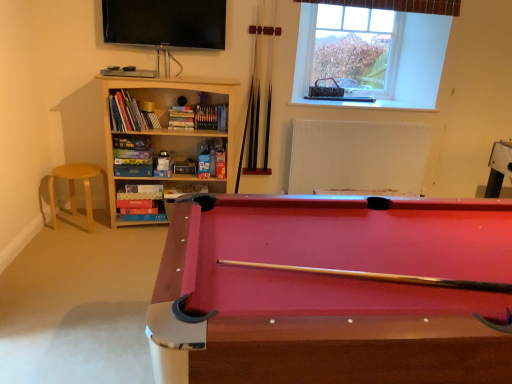
Question: Can you confirm if clear glass window at upper center is shorter than wooden bookcase at left?

Choices:
 (A) yes
 (B) no

Answer: (A)

Question: Is clear glass window at upper center not close to wooden bookcase at left?

Choices:
 (A) yes
 (B) no

Answer: (A)

Question: Considering the relative positions of clear glass window at upper center and wooden bookcase at left in the image provided, is clear glass window at upper center in front of wooden bookcase at left?

Choices:
 (A) no
 (B) yes

Answer: (A)

Question: Could you tell me if clear glass window at upper center is turned towards wooden bookcase at left?

Choices:
 (A) no
 (B) yes

Answer: (A)

Question: Is wooden bookcase at left at the back of clear glass window at upper center?

Choices:
 (A) no
 (B) yes

Answer: (A)

Question: From the image's perspective, is clear glass window at upper center located beneath wooden bookcase at left?

Choices:
 (A) yes
 (B) no

Answer: (B)

Question: From a real-world perspective, is clear glass window at upper center located higher than light wood stool at left?

Choices:
 (A) yes
 (B) no

Answer: (A)

Question: From a real-world perspective, is clear glass window at upper center under light wood stool at left?

Choices:
 (A) yes
 (B) no

Answer: (B)

Question: From the image's perspective, is clear glass window at upper center under light wood stool at left?

Choices:
 (A) no
 (B) yes

Answer: (A)

Question: Is clear glass window at upper center outside light wood stool at left?

Choices:
 (A) yes
 (B) no

Answer: (A)

Question: Can you confirm if clear glass window at upper center is thinner than light wood stool at left?

Choices:
 (A) no
 (B) yes

Answer: (B)

Question: Does clear glass window at upper center lie behind light wood stool at left?

Choices:
 (A) yes
 (B) no

Answer: (A)

Question: Would you consider light wood stool at left to be distant from white matte radiator at upper center?

Choices:
 (A) no
 (B) yes

Answer: (B)